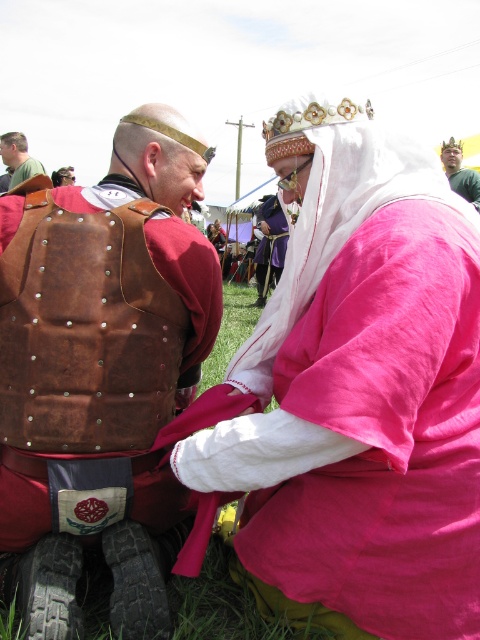
Is brown leather vest at center wider than green fabric headband at upper center?

Yes.

In order to click on brown leather vest at center in this screenshot , I will do `click(103, 336)`.

Based on the photo, who is more forward, [479,211] or [2,148]?

Point [479,211] is more forward.

Describe the element at coordinates (459, 172) in the screenshot. I see `green fabric headband at upper center` at that location.

This screenshot has width=480, height=640. Find the location of `green fabric headband at upper center`. green fabric headband at upper center is located at coordinates (459, 172).

What do you see at coordinates (103, 336) in the screenshot? The image size is (480, 640). I see `brown leather vest at center` at bounding box center [103, 336].

Does brown leather vest at center have a lesser height compared to light brown leather vest at left?

No.

Image resolution: width=480 pixels, height=640 pixels. What do you see at coordinates (103, 336) in the screenshot?
I see `brown leather vest at center` at bounding box center [103, 336].

Image resolution: width=480 pixels, height=640 pixels. What are the coordinates of `brown leather vest at center` in the screenshot? It's located at (103, 336).